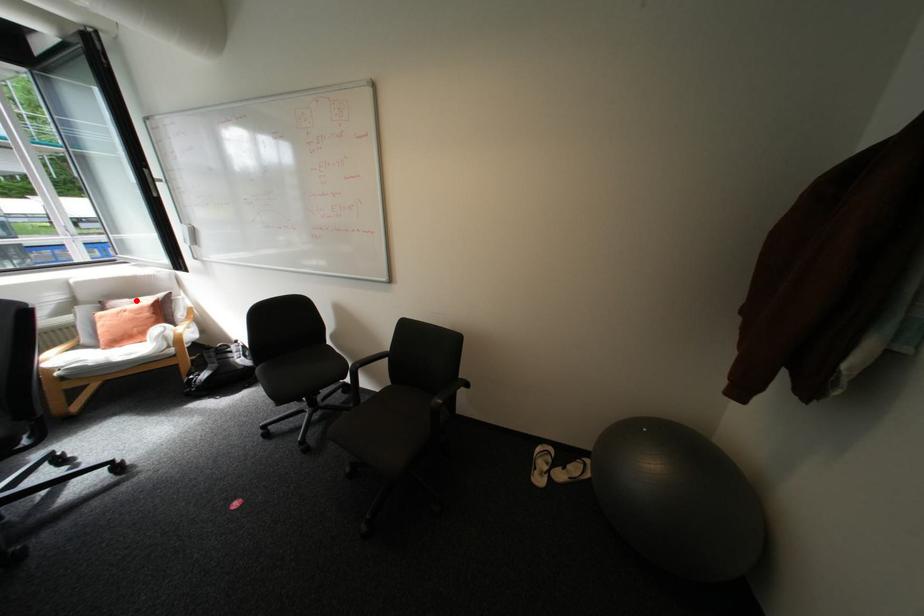
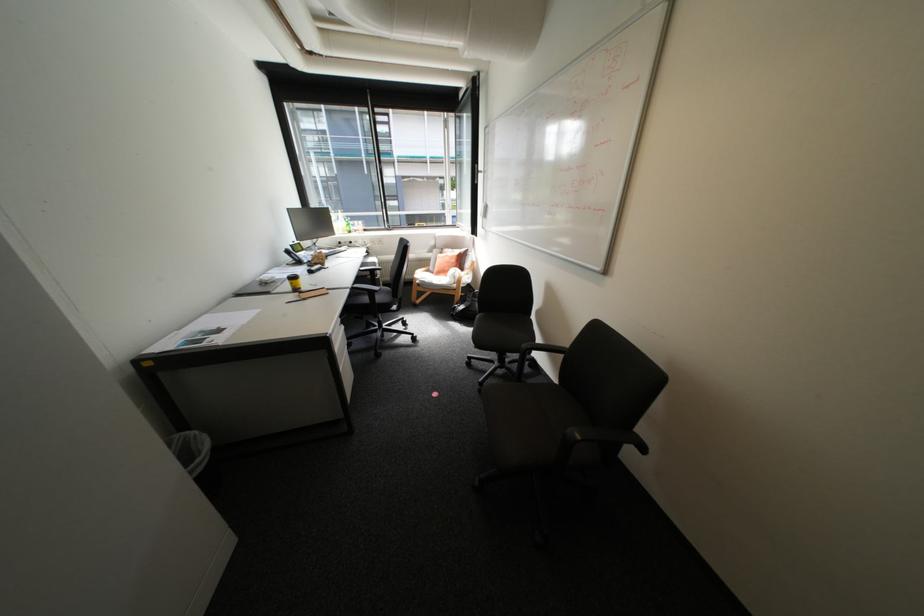
Question: I am providing you with two images of the same scene from different viewpoints. Given a red point in image1, look at the same physical point in image2. Is it:

Choices:
 (A) Closer to the viewpoint
 (B) Farther from the viewpoint

Answer: (A)